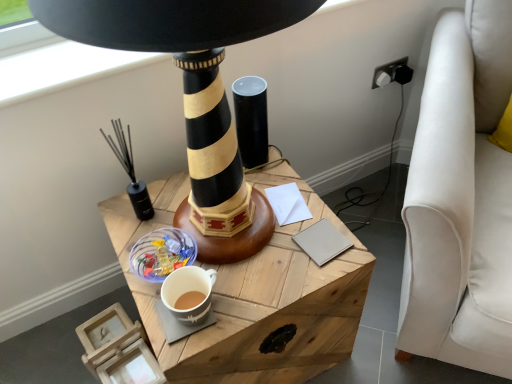
Question: From a real-world perspective, is wooden table at center located beneath black matte candle holder at left, which is the 1th candle holder in left-to-right order?

Choices:
 (A) no
 (B) yes

Answer: (B)

Question: Considering the relative sizes of wooden table at center and black matte candle holder at left, which is the 2th candle holder from right to left, in the image provided, is wooden table at center shorter than black matte candle holder at left, which is the 2th candle holder from right to left,?

Choices:
 (A) yes
 (B) no

Answer: (B)

Question: Can you confirm if wooden table at center is positioned to the right of black matte candle holder at left, which is the 2th candle holder from right to left?

Choices:
 (A) no
 (B) yes

Answer: (B)

Question: Would you say wooden table at center is outside black matte candle holder at left, which is the 2th candle holder from right to left?

Choices:
 (A) no
 (B) yes

Answer: (B)

Question: From a real-world perspective, is wooden table at center on black matte candle holder at left, which is the 2th candle holder from right to left?

Choices:
 (A) yes
 (B) no

Answer: (B)

Question: From the image's perspective, relative to matte black cylinder at center, which ranks as the first candle holder in right-to-left order, is beige leather notepad at center, placed as the 1th notepad when sorted from front to back, above or below?

Choices:
 (A) above
 (B) below

Answer: (B)

Question: Is beige leather notepad at center, the second notepad positioned from the back, in front of or behind matte black cylinder at center, which is counted as the 2th candle holder, starting from the left, in the image?

Choices:
 (A) front
 (B) behind

Answer: (A)

Question: Do you think beige leather notepad at center, placed as the 1th notepad when sorted from front to back, is within matte black cylinder at center, which ranks as the first candle holder in right-to-left order, or outside of it?

Choices:
 (A) outside
 (B) inside

Answer: (A)

Question: Is beige leather notepad at center, the second notepad positioned from the back, wider or thinner than matte black cylinder at center, which is counted as the 2th candle holder, starting from the left?

Choices:
 (A) thin
 (B) wide

Answer: (A)

Question: Is matte ceramic mug at lower center inside the boundaries of matte black cylinder at center, which is counted as the 2th candle holder, starting from the left, or outside?

Choices:
 (A) outside
 (B) inside

Answer: (A)

Question: Considering the relative positions of matte ceramic mug at lower center and matte black cylinder at center, which is counted as the 2th candle holder, starting from the left, in the image provided, is matte ceramic mug at lower center to the left or to the right of matte black cylinder at center, which is counted as the 2th candle holder, starting from the left,?

Choices:
 (A) left
 (B) right

Answer: (A)

Question: Considering the positions of matte ceramic mug at lower center and matte black cylinder at center, which ranks as the first candle holder in right-to-left order, in the image, is matte ceramic mug at lower center wider or thinner than matte black cylinder at center, which ranks as the first candle holder in right-to-left order,?

Choices:
 (A) wide
 (B) thin

Answer: (B)

Question: From a real-world perspective, is matte ceramic mug at lower center above or below matte black cylinder at center, which is counted as the 2th candle holder, starting from the left?

Choices:
 (A) above
 (B) below

Answer: (B)

Question: Do you think white paper at center, which is the 1th notepad from back to front, is within beige leather notepad at center, the second notepad positioned from the back, or outside of it?

Choices:
 (A) outside
 (B) inside

Answer: (A)

Question: Is white paper at center, which is the 1th notepad from back to front, in front of or behind beige leather notepad at center, the second notepad positioned from the back, in the image?

Choices:
 (A) behind
 (B) front

Answer: (A)